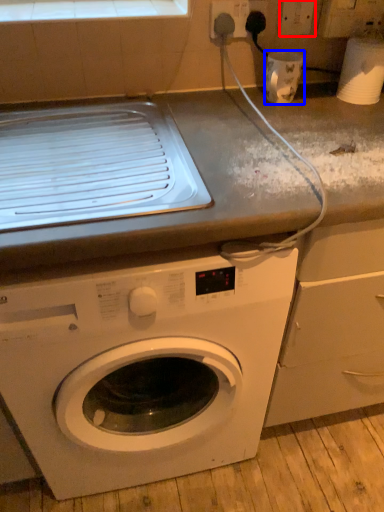
Question: Which object is closer to the camera taking this photo, electric outlet (highlighted by a red box) or appliance (highlighted by a blue box)?

Choices:
 (A) electric outlet
 (B) appliance

Answer: (B)